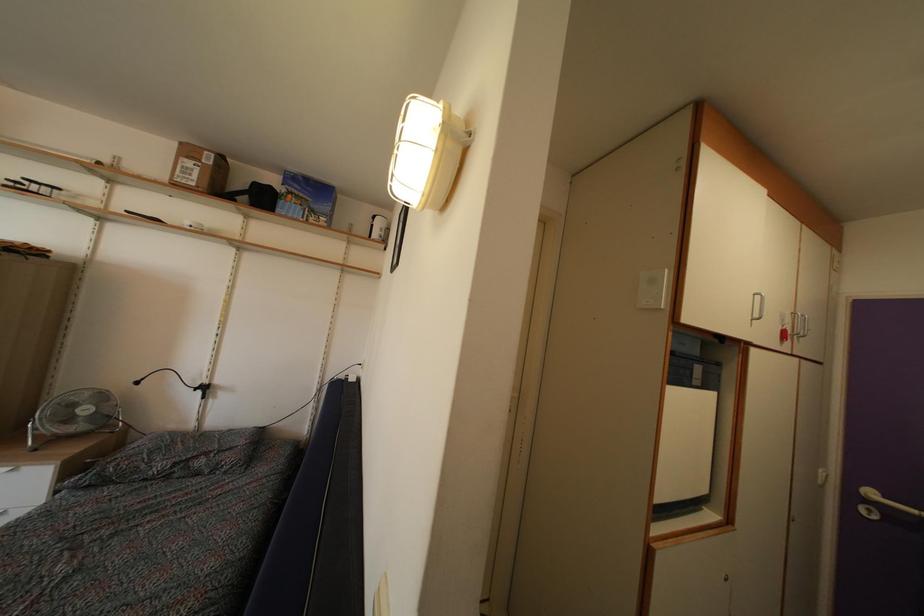
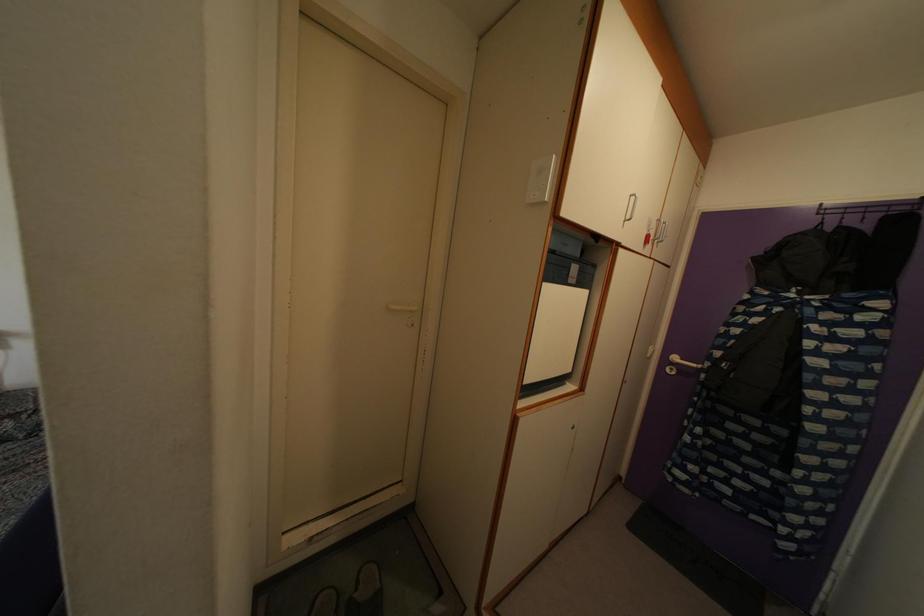
Where in the second image is the point corresponding to (657,290) from the first image?

(544, 180)